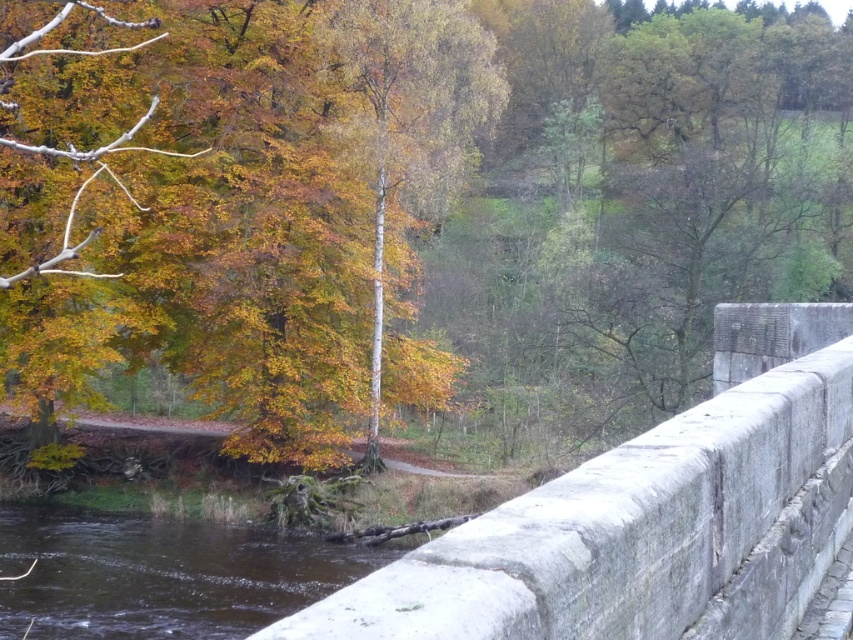
In the scene shown: Does gray stone bridge at center appear on the left side of brown/rough wood at lower left?

In fact, gray stone bridge at center is to the right of brown/rough wood at lower left.

Who is more distant from viewer, (640, 493) or (221, 621)?

Point (221, 621)

Where is `gray stone bridge at center`? gray stone bridge at center is located at coordinates (651, 515).